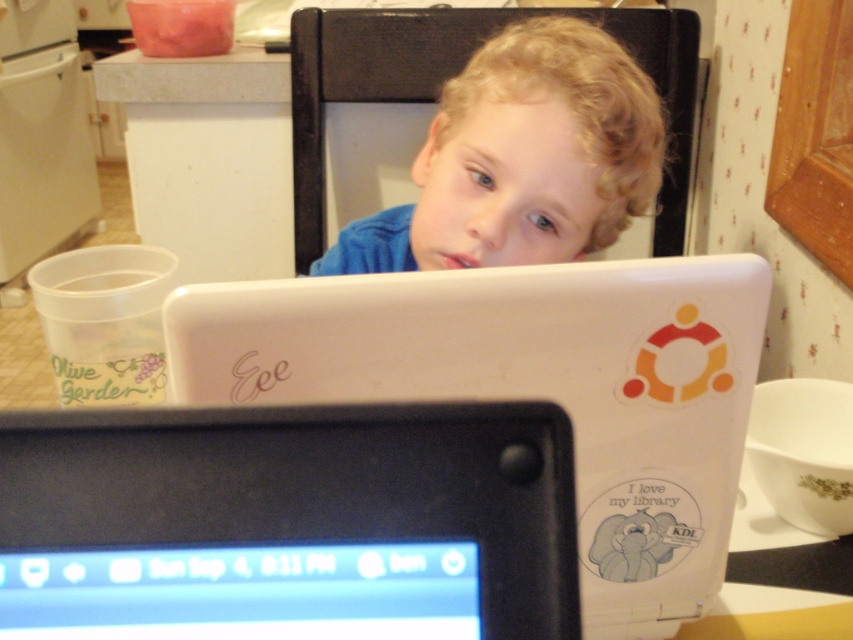
Question: Can you confirm if white matte laptop at center is positioned to the right of blonde curly hair at upper center?

Choices:
 (A) no
 (B) yes

Answer: (B)

Question: Considering the relative positions of white matte laptop at center and black glossy screen at center in the image provided, where is white matte laptop at center located with respect to black glossy screen at center?

Choices:
 (A) above
 (B) below

Answer: (B)

Question: Which point is farther from the camera taking this photo?

Choices:
 (A) (196, 216)
 (B) (477, 488)

Answer: (A)

Question: Which point is farther from the camera taking this photo?

Choices:
 (A) 427,161
 (B) 642,392
 (C) 181,125
 (D) 62,413

Answer: (C)

Question: Does white matte laptop at center have a greater width compared to blonde curly hair at upper center?

Choices:
 (A) yes
 (B) no

Answer: (B)

Question: Estimate the real-world distances between objects in this image. Which object is farther from the blonde curly hair at upper center?

Choices:
 (A) white matte laptop at center
 (B) black glossy screen at center
 (C) white matte table at upper left

Answer: (C)